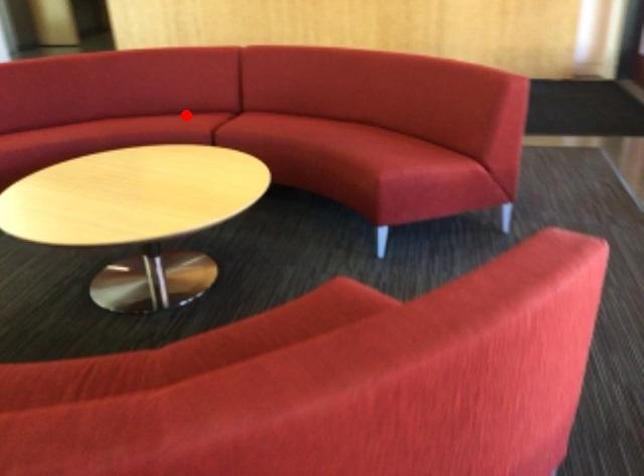
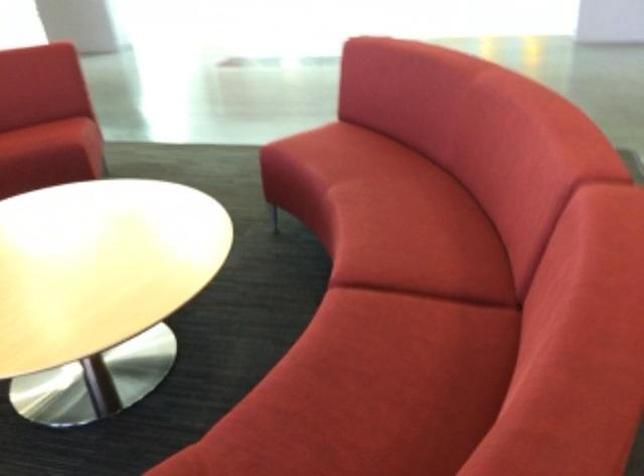
Question: I am providing you with two images of the same scene from different viewpoints. A red point is shown in image1. For the corresponding object point in image2, is it positioned nearer or farther from the camera?

Choices:
 (A) Nearer
 (B) Farther

Answer: (A)